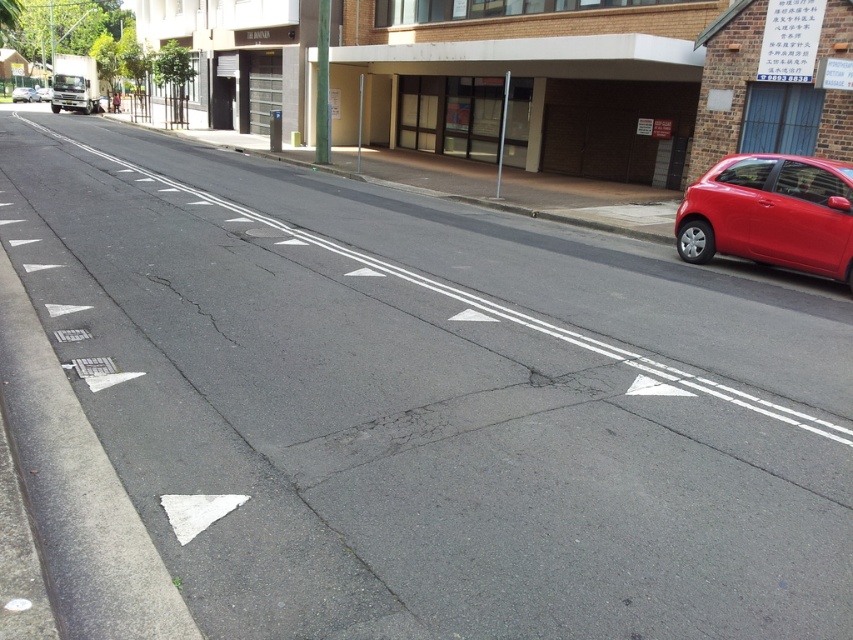
Based on the photo, which is below, shiny red hatchback at right or red glossy hatchback at right?

Positioned lower is shiny red hatchback at right.

Is point (848, 166) in front of point (50, 92)?

Yes, it is.

Does point (850, 211) come closer to viewer compared to point (41, 92)?

Yes.

Where is `shiny red hatchback at right`? Image resolution: width=853 pixels, height=640 pixels. shiny red hatchback at right is located at coordinates (770, 212).

Is metallic silver car at center behind red glossy hatchback at right?

No, it is not.

Who is higher up, metallic silver car at center or red glossy hatchback at right?

red glossy hatchback at right is above.

What do you see at coordinates (24, 93) in the screenshot? The height and width of the screenshot is (640, 853). I see `metallic silver car at center` at bounding box center [24, 93].

Identify the location of metallic silver car at center. (24, 93).

Does shiny red hatchback at right lie in front of metallic silver car at center?

Yes, shiny red hatchback at right is in front of metallic silver car at center.

Measure the distance between shiny red hatchback at right and camera.

shiny red hatchback at right is 8.97 meters from camera.

What do you see at coordinates (770, 212) in the screenshot? The width and height of the screenshot is (853, 640). I see `shiny red hatchback at right` at bounding box center [770, 212].

You are a GUI agent. You are given a task and a screenshot of the screen. Output one action in this format:
    pyautogui.click(x=<x>, y=<y>)
    Task: Click on the shiny red hatchback at right
    
    Given the screenshot: What is the action you would take?
    pyautogui.click(x=770, y=212)